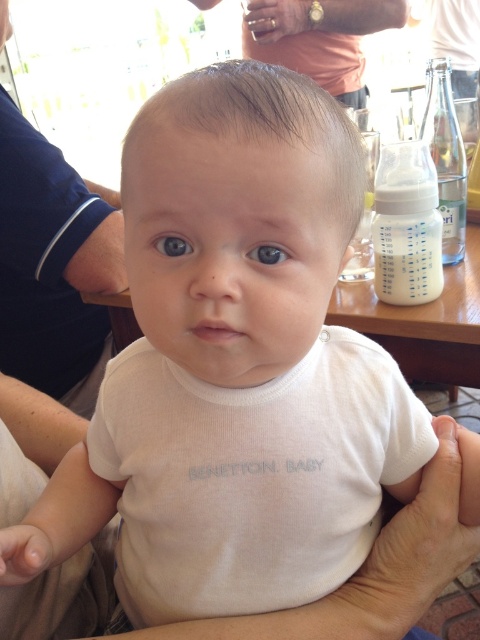
What do you see at coordinates (54, 266) in the screenshot? This screenshot has width=480, height=640. I see `blue cotton shirt at left` at bounding box center [54, 266].

Is blue cotton shirt at left positioned at the back of blue glossy eye at center?

Yes, blue cotton shirt at left is behind blue glossy eye at center.

Who is more forward, (103, 288) or (273, 257)?

Positioned in front is point (273, 257).

Where is `blue cotton shirt at left`? The width and height of the screenshot is (480, 640). blue cotton shirt at left is located at coordinates (54, 266).

Can you confirm if orange t-shirt at upper center is positioned above blue glossy eye at center?

Correct, orange t-shirt at upper center is located above blue glossy eye at center.

Which of these two, orange t-shirt at upper center or blue glossy eye at center, stands taller?

orange t-shirt at upper center is taller.

Where is `orange t-shirt at upper center`? orange t-shirt at upper center is located at coordinates (320, 36).

In order to click on orange t-shirt at upper center in this screenshot , I will do `click(320, 36)`.

Which is below, light brown smooth hair at center or brown glossy eye at center?

Positioned lower is brown glossy eye at center.

Which is behind, point (156, 93) or point (179, 236)?

The point (156, 93) is behind.

The height and width of the screenshot is (640, 480). In order to click on light brown smooth hair at center in this screenshot , I will do `click(262, 122)`.